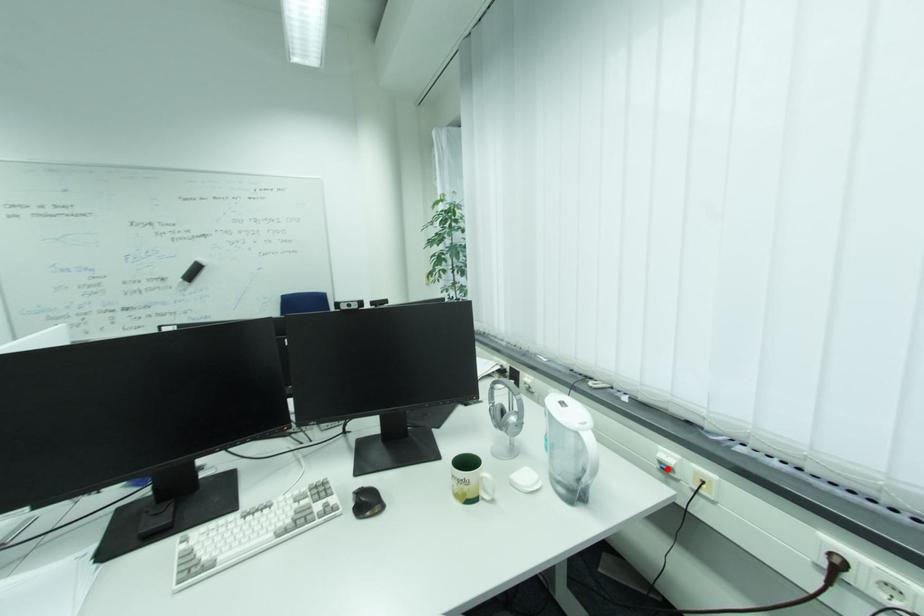
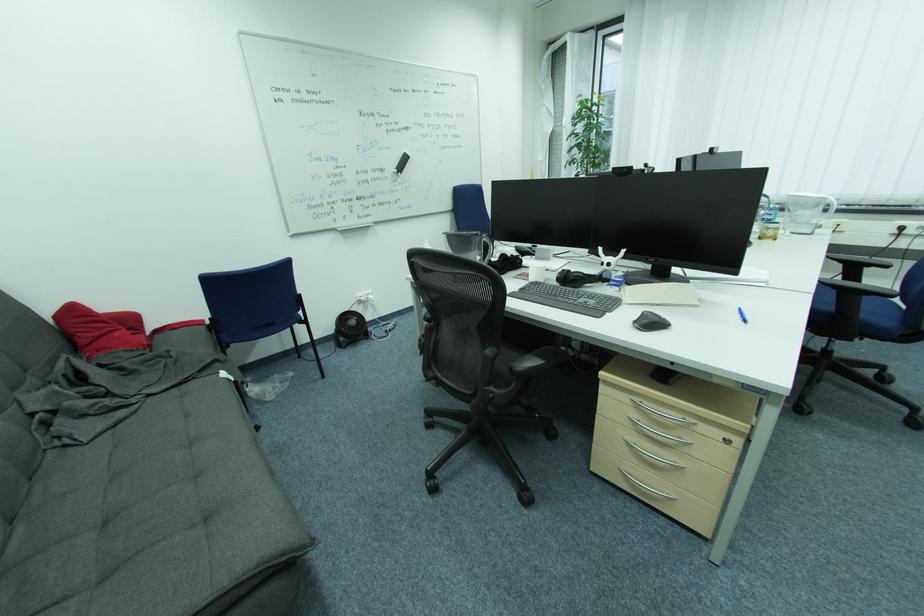
Question: I am providing you with two images of the same scene from different viewpoints. A red point is marked on the first image. Is the red point's position out of view in image 2?

Choices:
 (A) Yes
 (B) No

Answer: (A)